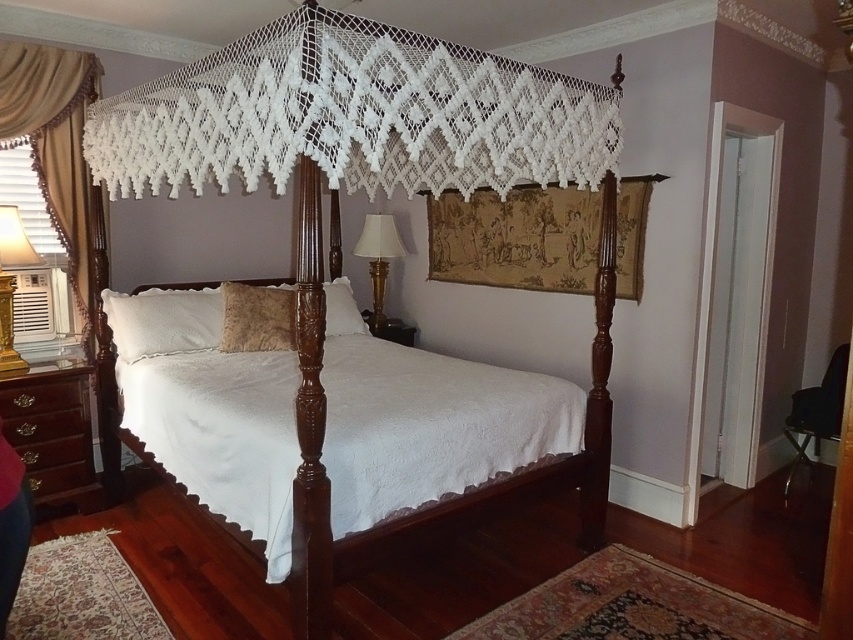
Can you confirm if beige satin curtain at left is positioned to the right of gold metallic lamp at left?

Correct, you'll find beige satin curtain at left to the right of gold metallic lamp at left.

Is beige satin curtain at left shorter than gold metallic lamp at left?

Incorrect, beige satin curtain at left's height does not fall short of gold metallic lamp at left's.

Between point (36, 134) and point (3, 244), which one is positioned behind?

The point (36, 134) is behind.

You are a GUI agent. You are given a task and a screenshot of the screen. Output one action in this format:
    pyautogui.click(x=<x>, y=<y>)
    Task: Click on the beige satin curtain at left
    The image size is (853, 640).
    Given the screenshot: What is the action you would take?
    pyautogui.click(x=54, y=145)

Does point (432, 499) lie in front of point (381, 214)?

Yes, point (432, 499) is in front of point (381, 214).

Does white cotton bedspread at center have a smaller size compared to wooden lampshade at right?

No, white cotton bedspread at center is not smaller than wooden lampshade at right.

You are a GUI agent. You are given a task and a screenshot of the screen. Output one action in this format:
    pyautogui.click(x=<x>, y=<y>)
    Task: Click on the white cotton bedspread at center
    
    Given the screenshot: What is the action you would take?
    pyautogui.click(x=431, y=426)

Who is positioned more to the right, white fluffy pillow at center or white soft pillow at center?

From the viewer's perspective, white soft pillow at center appears more on the right side.

Can you confirm if white fluffy pillow at center is positioned to the left of white soft pillow at center?

Yes, white fluffy pillow at center is to the left of white soft pillow at center.

Does point (167, 305) lie in front of point (345, 330)?

That is True.

You are a GUI agent. You are given a task and a screenshot of the screen. Output one action in this format:
    pyautogui.click(x=<x>, y=<y>)
    Task: Click on the white fluffy pillow at center
    
    Given the screenshot: What is the action you would take?
    pyautogui.click(x=163, y=321)